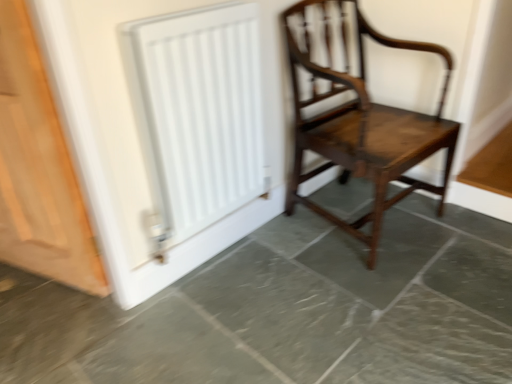
Question: Is the depth of white matte radiator at upper left less than that of mahogany wooden chair at center?

Choices:
 (A) no
 (B) yes

Answer: (B)

Question: From a real-world perspective, does white matte radiator at upper left stand above mahogany wooden chair at center?

Choices:
 (A) no
 (B) yes

Answer: (B)

Question: Is mahogany wooden chair at center located within white matte radiator at upper left?

Choices:
 (A) yes
 (B) no

Answer: (B)

Question: Is white matte radiator at upper left further to the viewer compared to mahogany wooden chair at center?

Choices:
 (A) yes
 (B) no

Answer: (B)

Question: Does white matte radiator at upper left appear on the left side of mahogany wooden chair at center?

Choices:
 (A) no
 (B) yes

Answer: (B)

Question: In terms of size, does white matte radiator at upper left appear bigger or smaller than mahogany wooden chair at center?

Choices:
 (A) small
 (B) big

Answer: (A)

Question: Would you say white matte radiator at upper left is to the left or to the right of mahogany wooden chair at center in the picture?

Choices:
 (A) right
 (B) left

Answer: (B)

Question: Does point coord(205,177) appear closer or farther from the camera than point coord(321,0)?

Choices:
 (A) closer
 (B) farther

Answer: (A)

Question: Considering the positions of white matte radiator at upper left and mahogany wooden chair at center in the image, is white matte radiator at upper left taller or shorter than mahogany wooden chair at center?

Choices:
 (A) tall
 (B) short

Answer: (B)

Question: Is mahogany wooden chair at center situated inside light brown wood door at left or outside?

Choices:
 (A) inside
 (B) outside

Answer: (B)

Question: From the image's perspective, is mahogany wooden chair at center located above or below light brown wood door at left?

Choices:
 (A) below
 (B) above

Answer: (B)

Question: Is mahogany wooden chair at center in front of or behind light brown wood door at left in the image?

Choices:
 (A) behind
 (B) front

Answer: (A)

Question: Considering the positions of mahogany wooden chair at center and light brown wood door at left in the image, is mahogany wooden chair at center bigger or smaller than light brown wood door at left?

Choices:
 (A) small
 (B) big

Answer: (B)

Question: In the image, is gray marble floor at center on the left side or the right side of white matte radiator at upper left?

Choices:
 (A) right
 (B) left

Answer: (A)

Question: From the image's perspective, relative to white matte radiator at upper left, is gray marble floor at center above or below?

Choices:
 (A) above
 (B) below

Answer: (B)